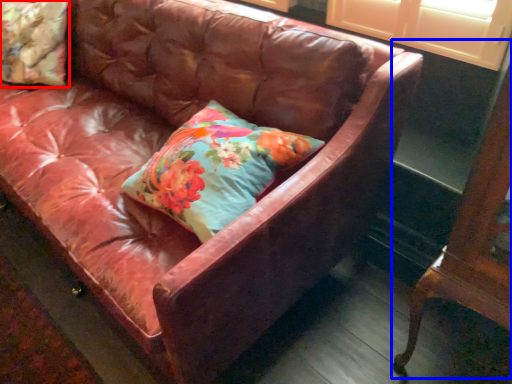
Question: Which of the following is the closest to the observer, pillow (highlighted by a red box) or furniture (highlighted by a blue box)?

Choices:
 (A) pillow
 (B) furniture

Answer: (B)